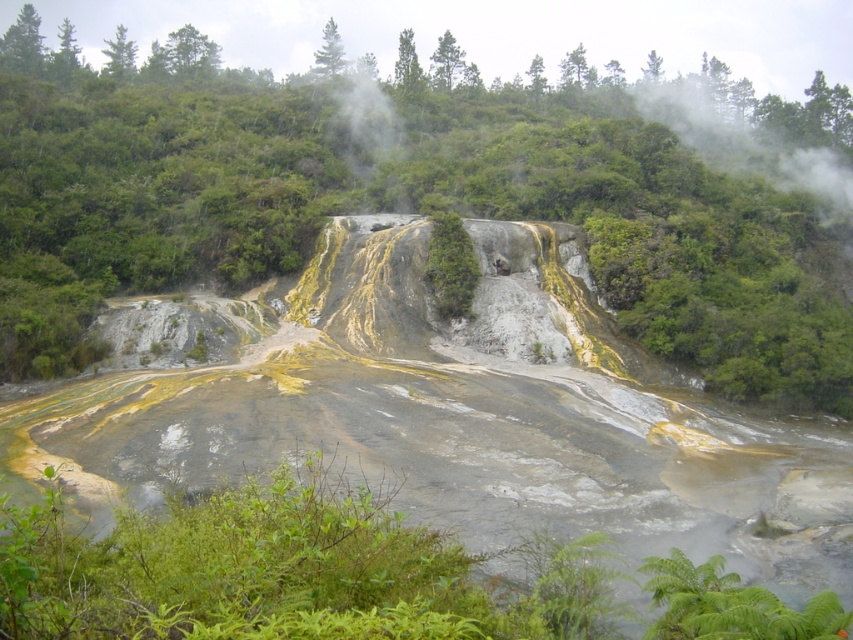
Question: Is yellowish sedimentary rock at center further to the viewer compared to green leafy shrub at center?

Choices:
 (A) no
 (B) yes

Answer: (A)

Question: Which point appears farthest from the camera in this image?

Choices:
 (A) (451, 220)
 (B) (329, 627)
 (C) (283, 273)

Answer: (C)

Question: Based on their relative distances, which object is farther from the green leafy shrubs at lower center?

Choices:
 (A) green leafy vegetation at center
 (B) green leafy shrub at center

Answer: (A)

Question: Which object is farther from the camera taking this photo?

Choices:
 (A) yellowish sedimentary rock at center
 (B) green leafy shrubs at lower center
 (C) green leafy vegetation at center
 (D) green leafy shrub at center

Answer: (D)

Question: Can you confirm if green leafy shrubs at lower center is positioned to the right of green leafy shrub at center?

Choices:
 (A) no
 (B) yes

Answer: (A)

Question: Is yellowish sedimentary rock at center closer to the viewer compared to green leafy shrubs at lower center?

Choices:
 (A) yes
 (B) no

Answer: (B)